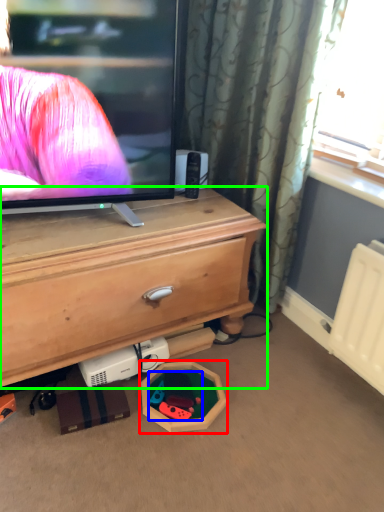
Question: Estimate the real-world distances between objects in this image. Which object is farther from toy (highlighted by a red box), toy (highlighted by a blue box) or chest of drawers (highlighted by a green box)?

Choices:
 (A) toy
 (B) chest of drawers

Answer: (B)